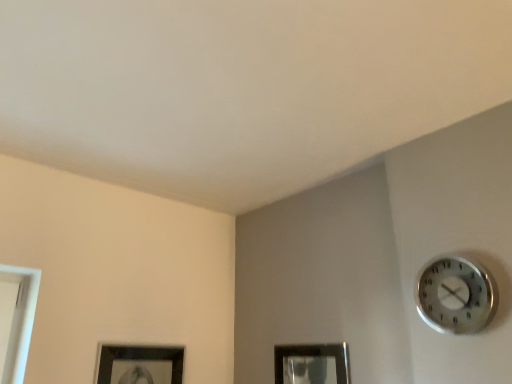
Measure the distance between point (302, 372) and camera.

The distance of point (302, 372) from camera is 5.93 feet.

What is the approximate width of matte black picture frame at lower center?

The width of matte black picture frame at lower center is 0.80 inches.

What do you see at coordinates (311, 363) in the screenshot? I see `matte black picture frame at lower center` at bounding box center [311, 363].

At what (x,y) coordinates should I click in order to perform the action: click on matte black picture frame at lower center. Please return your answer as a coordinate pair (x, y). The width and height of the screenshot is (512, 384). Looking at the image, I should click on (311, 363).

I want to click on silver metallic clock at upper right, so click(456, 295).

The image size is (512, 384). Describe the element at coordinates (456, 295) in the screenshot. I see `silver metallic clock at upper right` at that location.

What is the approximate width of silver metallic clock at upper right?

silver metallic clock at upper right is 4.14 centimeters in width.

I want to click on matte black picture frame at lower center, so click(311, 363).

Is silver metallic clock at upper right to the left or to the right of matte black picture frame at lower center in the image?

Based on their positions, silver metallic clock at upper right is located to the right of matte black picture frame at lower center.

Is silver metallic clock at upper right in front of matte black picture frame at lower center?

Yes, silver metallic clock at upper right is closer to the viewer.

Considering the positions of point (440, 296) and point (313, 363), is point (440, 296) closer or farther from the camera than point (313, 363)?

Point (440, 296).

From the image's perspective, which object appears higher, silver metallic clock at upper right or matte black picture frame at lower center?

From the image's view, silver metallic clock at upper right is above.

From a real-world perspective, which is physically below, silver metallic clock at upper right or matte black picture frame at lower center?

In real-world perspective, matte black picture frame at lower center is lower.

From the picture: In terms of width, does silver metallic clock at upper right look wider or thinner when compared to matte black picture frame at lower center?

silver metallic clock at upper right is wider than matte black picture frame at lower center.

Can you confirm if silver metallic clock at upper right is taller than matte black picture frame at lower center?

Incorrect, the height of silver metallic clock at upper right is not larger of that of matte black picture frame at lower center.

Considering the relative sizes of silver metallic clock at upper right and matte black picture frame at lower center in the image provided, is silver metallic clock at upper right smaller than matte black picture frame at lower center?

Incorrect, silver metallic clock at upper right is not smaller in size than matte black picture frame at lower center.

Is silver metallic clock at upper right situated inside matte black picture frame at lower center or outside?

silver metallic clock at upper right cannot be found inside matte black picture frame at lower center.

Would you consider silver metallic clock at upper right to be distant from matte black picture frame at lower center?

No, silver metallic clock at upper right is not far away from matte black picture frame at lower center.

Does silver metallic clock at upper right turn towards matte black picture frame at lower center?

No, silver metallic clock at upper right is not facing towards matte black picture frame at lower center.

Can you tell me how much silver metallic clock at upper right and matte black picture frame at lower center differ in facing direction?

The facing directions of silver metallic clock at upper right and matte black picture frame at lower center are 0.724 degrees apart.

Measure the distance between silver metallic clock at upper right and matte black picture frame at lower center.

55.12 centimeters.

Image resolution: width=512 pixels, height=384 pixels. I want to click on wall clock on the right of matte black picture frame at lower center, so pyautogui.click(x=456, y=295).

Considering the relative positions of matte black picture frame at lower center and silver metallic clock at upper right in the image provided, is matte black picture frame at lower center to the right of silver metallic clock at upper right from the viewer's perspective?

No.

In the scene shown: Which is behind, matte black picture frame at lower center or silver metallic clock at upper right?

matte black picture frame at lower center is further away from the camera.

Is point (316, 377) closer or farther from the camera than point (481, 313)?

Point (316, 377).

From the image's perspective, is matte black picture frame at lower center located above or below silver metallic clock at upper right?

matte black picture frame at lower center is below silver metallic clock at upper right.

Looking at this image, from a real-world perspective, who is located higher, matte black picture frame at lower center or silver metallic clock at upper right?

silver metallic clock at upper right, from a real-world perspective.

Considering the sizes of objects matte black picture frame at lower center and silver metallic clock at upper right in the image provided, who is thinner, matte black picture frame at lower center or silver metallic clock at upper right?

matte black picture frame at lower center.

Considering the relative sizes of matte black picture frame at lower center and silver metallic clock at upper right in the image provided, is matte black picture frame at lower center shorter than silver metallic clock at upper right?

Incorrect, the height of matte black picture frame at lower center does not fall short of that of silver metallic clock at upper right.

Between matte black picture frame at lower center and silver metallic clock at upper right, which one has smaller size?

Smaller between the two is matte black picture frame at lower center.

Consider the image. Do you think matte black picture frame at lower center is within silver metallic clock at upper right, or outside of it?

matte black picture frame at lower center is outside silver metallic clock at upper right.

Are matte black picture frame at lower center and silver metallic clock at upper right beside each other?

They are not placed beside each other.

Is matte black picture frame at lower center facing away from silver metallic clock at upper right?

matte black picture frame at lower center does not have its back to silver metallic clock at upper right.

From the picture: How many degrees apart are the facing directions of matte black picture frame at lower center and silver metallic clock at upper right?

0.724 degrees.

Find the location of `wall clock in front of the matte black picture frame at lower center`. wall clock in front of the matte black picture frame at lower center is located at coordinates (456, 295).

This screenshot has width=512, height=384. Find the location of `wall clock in front of the matte black picture frame at lower center`. wall clock in front of the matte black picture frame at lower center is located at coordinates (456, 295).

In the image, there is a silver metallic clock at upper right. Where is `picture frame below it (from the image's perspective)`? picture frame below it (from the image's perspective) is located at coordinates (311, 363).